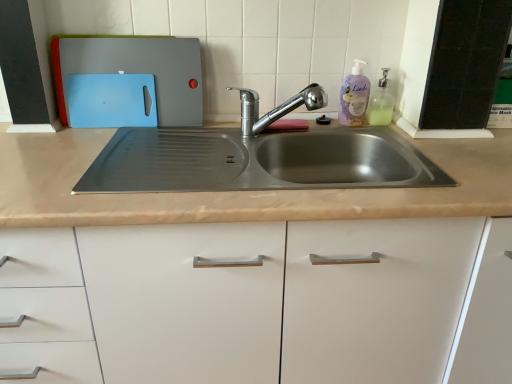
Question: In the image, is translucent plastic soap dispenser at upper right positioned in front of or behind chrome metallic faucet at center?

Choices:
 (A) front
 (B) behind

Answer: (B)

Question: Would you say translucent plastic soap dispenser at upper right is inside or outside chrome metallic faucet at center?

Choices:
 (A) outside
 (B) inside

Answer: (A)

Question: Estimate the real-world distances between objects in this image. Which object is closer to the matte plastic cutting boards at upper left?

Choices:
 (A) translucent plastic soap dispenser at upper right
 (B) purple matte bottle at upper right
 (C) chrome metallic faucet at center

Answer: (C)

Question: Based on their relative distances, which object is nearer to the chrome metallic faucet at center?

Choices:
 (A) translucent plastic soap dispenser at upper right
 (B) purple matte bottle at upper right
 (C) matte plastic cutting boards at upper left

Answer: (B)